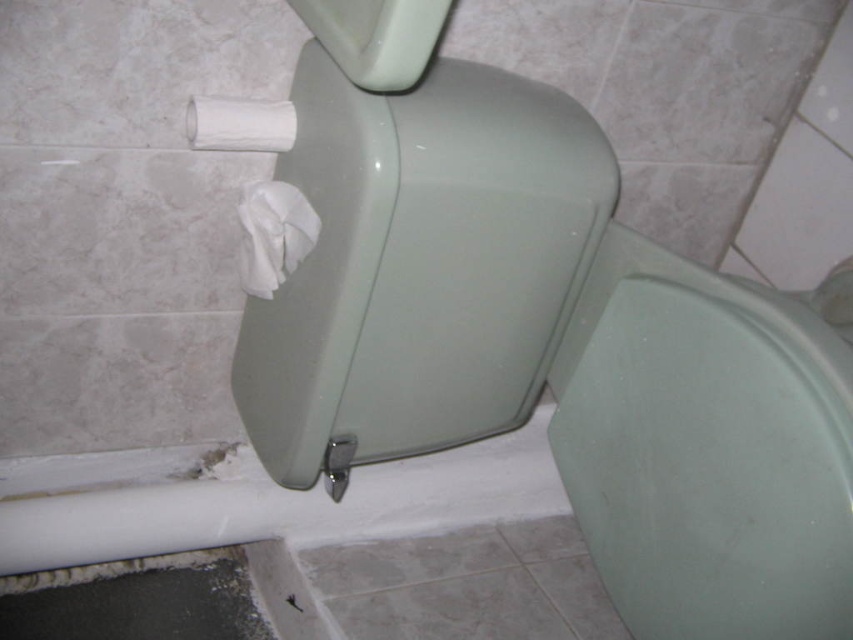
Is matte green toilet bowl at center smaller than white matte toilet paper at upper left?

No, matte green toilet bowl at center is not smaller than white matte toilet paper at upper left.

Between matte green toilet bowl at center and white matte toilet paper at upper left, which one appears on the right side from the viewer's perspective?

From the viewer's perspective, matte green toilet bowl at center appears more on the right side.

Who is more distant from viewer, (521, 84) or (236, 128)?

The point (521, 84) is more distant.

I want to click on matte green toilet bowl at center, so click(x=544, y=339).

Who is taller, matte green toilet bowl at center or white matte toilet paper at center?

With more height is matte green toilet bowl at center.

Between matte green toilet bowl at center and white matte toilet paper at center, which one appears on the right side from the viewer's perspective?

From the viewer's perspective, matte green toilet bowl at center appears more on the right side.

Describe the element at coordinates (544, 339) in the screenshot. I see `matte green toilet bowl at center` at that location.

Where is `matte green toilet bowl at center`? matte green toilet bowl at center is located at coordinates 544,339.

Is white matte toilet paper at center thinner than white matte toilet paper at upper left?

Incorrect, white matte toilet paper at center's width is not less than white matte toilet paper at upper left's.

Identify the location of white matte toilet paper at center. This screenshot has width=853, height=640. (273, 234).